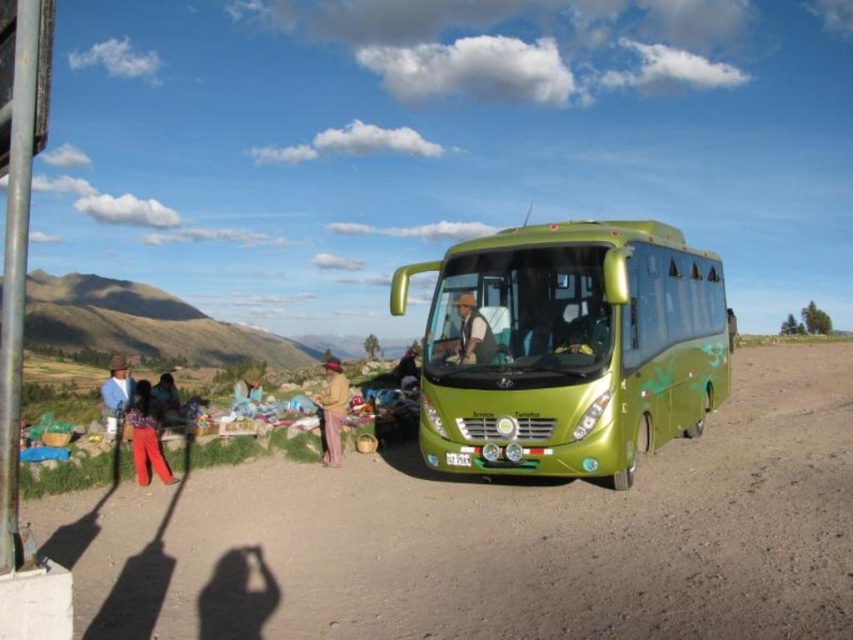
Which is behind, point (151, 412) or point (473, 296)?

Point (151, 412)

Is point (154, 417) more distant than point (473, 333)?

That is True.

Find the location of a particular element. The width and height of the screenshot is (853, 640). matte red pants at lower left is located at coordinates (146, 435).

Between green metallic bus at center and metal pole at left, which one has more height?

metal pole at left is taller.

Who is more forward, (695, 330) or (4, 577)?

Positioned in front is point (4, 577).

Locate an element on the screen. The image size is (853, 640). green metallic bus at center is located at coordinates (567, 348).

Can you confirm if green rubber dirt track at center is positioned above green metallic bus at center?

No.

Who is more forward, (434, 572) or (599, 342)?

Point (434, 572)

You are a GUI agent. You are given a task and a screenshot of the screen. Output one action in this format:
    pyautogui.click(x=<x>, y=<y>)
    Task: Click on the green rubber dirt track at center
    The image size is (853, 640).
    Given the screenshot: What is the action you would take?
    pyautogui.click(x=495, y=538)